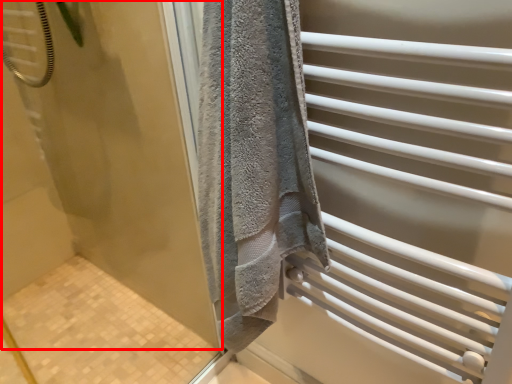
Question: Observing the image, what is the correct spatial positioning of screen door (annotated by the red box) in reference to screen door?

Choices:
 (A) right
 (B) left

Answer: (B)